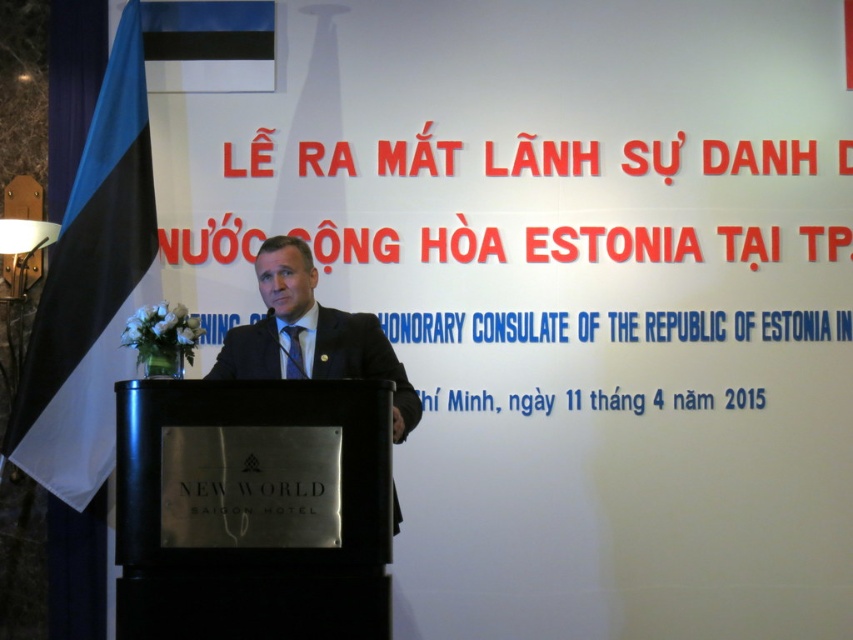
Is point (223, 611) in front of point (119, 160)?

Yes, point (223, 611) is closer to viewer.

Can you confirm if black polished wood podium at center is smaller than blue-white flag at left?

Correct, black polished wood podium at center occupies less space than blue-white flag at left.

Image resolution: width=853 pixels, height=640 pixels. Find the location of `black polished wood podium at center`. black polished wood podium at center is located at coordinates (252, 509).

Is blue-white flag at left shorter than black suit at center?

Incorrect, blue-white flag at left's height does not fall short of black suit at center's.

Which is behind, point (53, 360) or point (299, 376)?

Positioned behind is point (53, 360).

The width and height of the screenshot is (853, 640). I want to click on blue-white flag at left, so click(x=91, y=291).

Is point (132, 394) more distant than point (283, 276)?

No, it is not.

Between black polished wood podium at center and black suit at center, which one is positioned lower?

black polished wood podium at center is below.

What do you see at coordinates (252, 509) in the screenshot?
I see `black polished wood podium at center` at bounding box center [252, 509].

Where is `black polished wood podium at center`? The width and height of the screenshot is (853, 640). black polished wood podium at center is located at coordinates (252, 509).